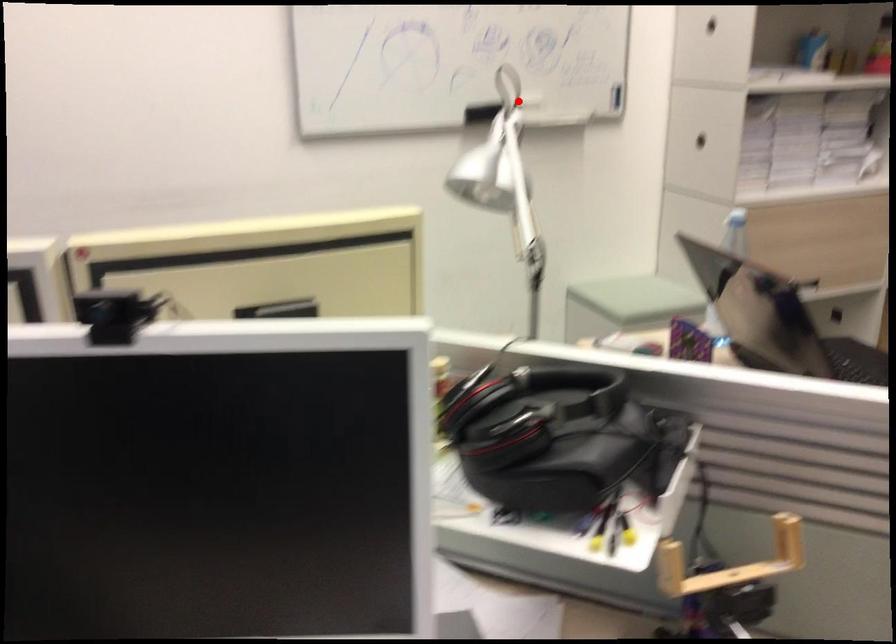
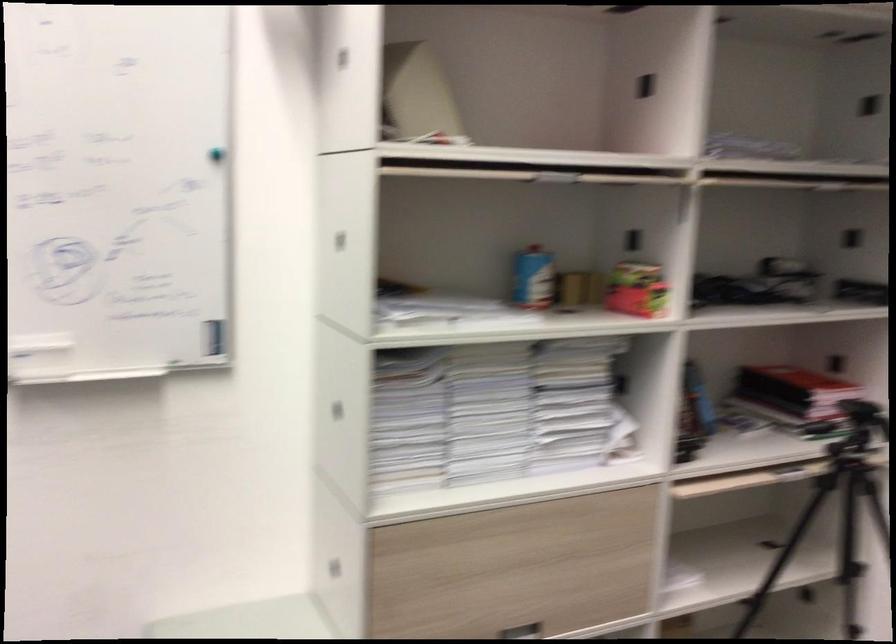
The point at the highlighted location is marked in the first image. Where is the corresponding point in the second image?

(33, 350)